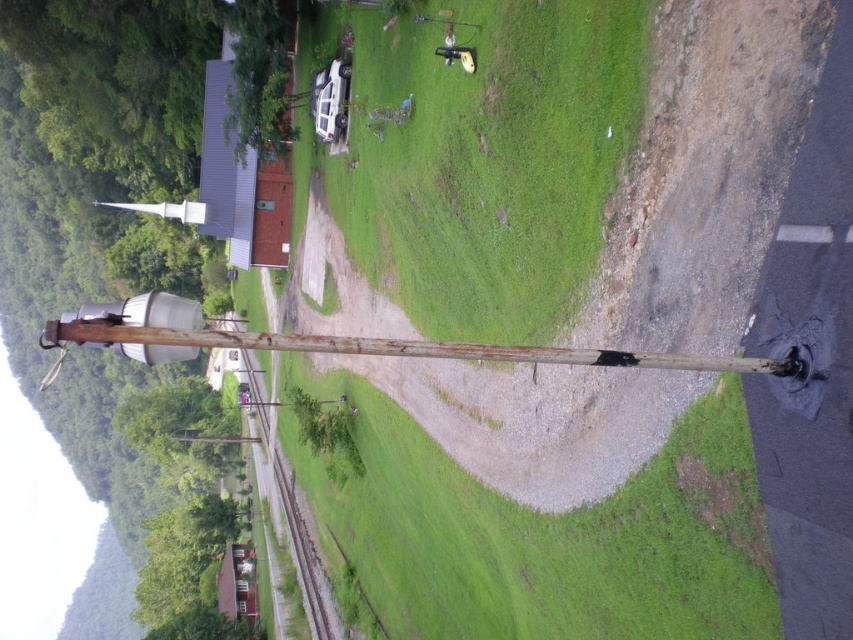
Question: In this image, where is green grassy at center located relative to rusty wood pole at left?

Choices:
 (A) below
 (B) above

Answer: (B)

Question: Does green grassy at center lie in front of rusty wood pole at left?

Choices:
 (A) no
 (B) yes

Answer: (A)

Question: Which point appears farthest from the camera in this image?

Choices:
 (A) (53, 321)
 (B) (374, 272)

Answer: (B)

Question: Which of the following is the farthest from the observer?

Choices:
 (A) green grassy at center
 (B) rusty wood pole at left

Answer: (A)

Question: Which point appears farthest from the camera in this image?

Choices:
 (A) (636, 500)
 (B) (316, 339)

Answer: (A)

Question: Does green grassy at center have a larger size compared to rusty wood pole at left?

Choices:
 (A) no
 (B) yes

Answer: (B)